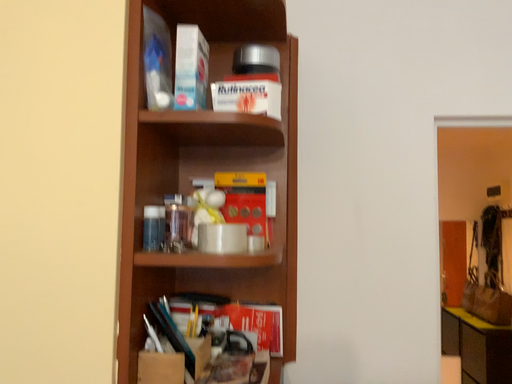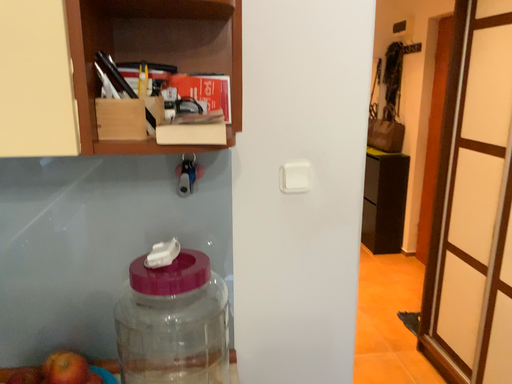
Question: Which way did the camera rotate in the video?

Choices:
 (A) rotated downward
 (B) rotated upward

Answer: (A)